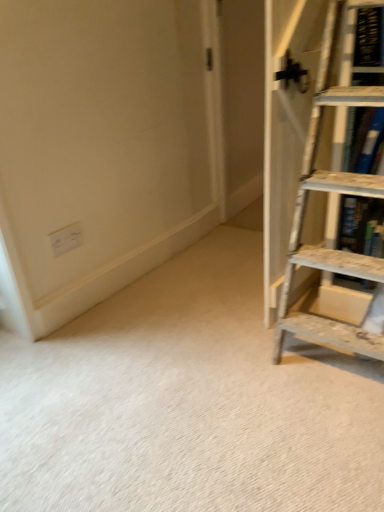
This screenshot has height=512, width=384. What do you see at coordinates (362, 47) in the screenshot?
I see `white marble shelf at right` at bounding box center [362, 47].

At what (x,y) coordinates should I click in order to perform the action: click on white marble shelf at right. Please return your answer as a coordinate pair (x, y). This screenshot has width=384, height=512. Looking at the image, I should click on (362, 47).

The height and width of the screenshot is (512, 384). In order to click on white marble shelf at right in this screenshot , I will do tap(362, 47).